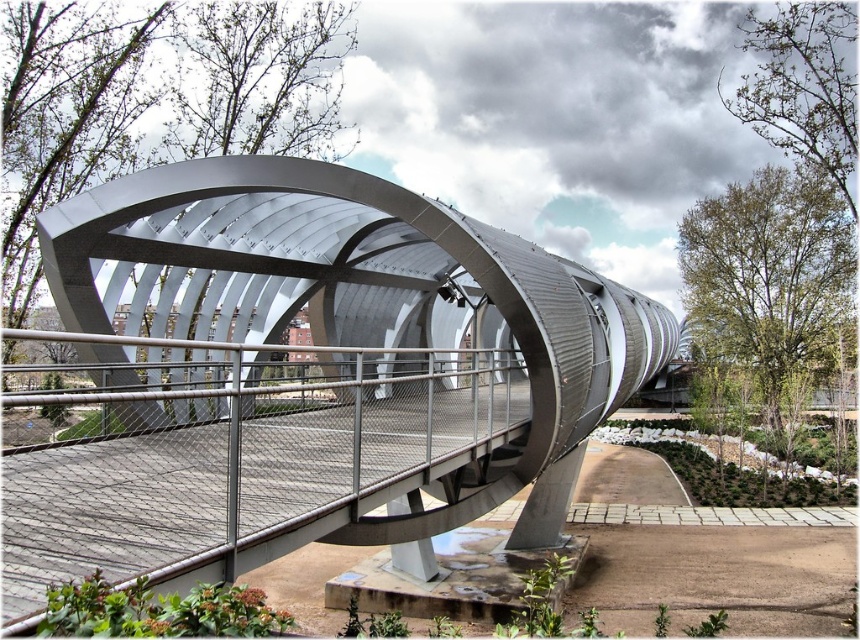
You are standing at the base of the bridge and want to take a photo of the polished steel bridge at center. If your camera has a maximum focus range of 10 feet, will you be able to capture the bridge clearly?

The polished steel bridge at center is 9.44 feet from camera, which is within the camera maximum focus range of 10 feet. So yes, you can capture the bridge clearly.

You are standing at the origin point of the coordinate system. Can you see the polished steel bridge at center from your current position?

The polished steel bridge at center is located at point (292, 380), so yes, you can see it from the origin point as it is positioned in the central area of the scene.